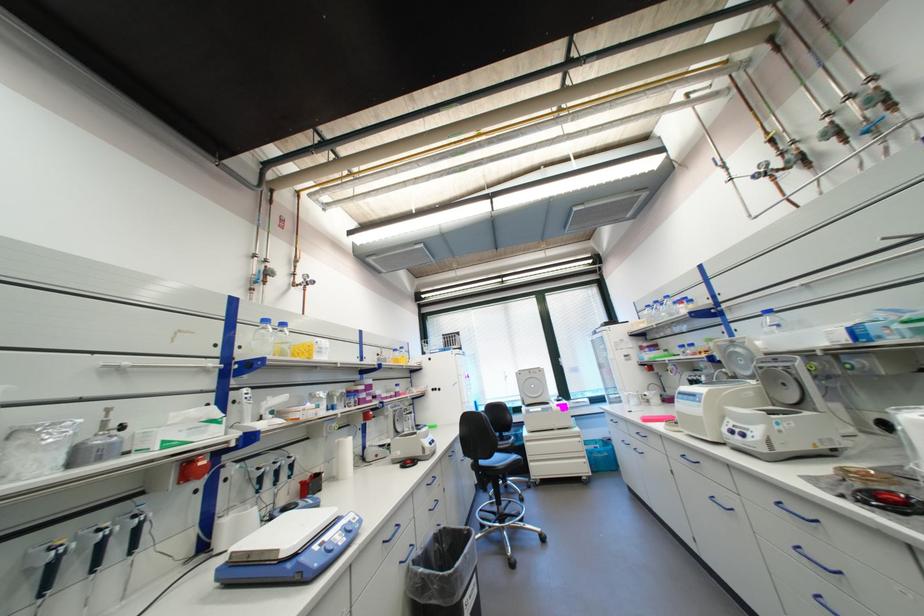
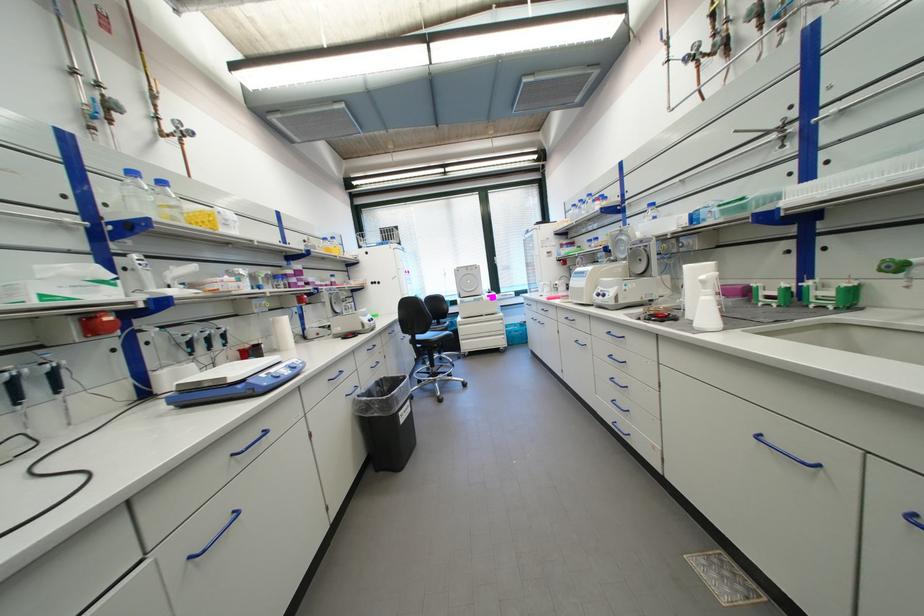
Where in the second image is the point corresponding to point 195,476 from the first image?

(101, 331)